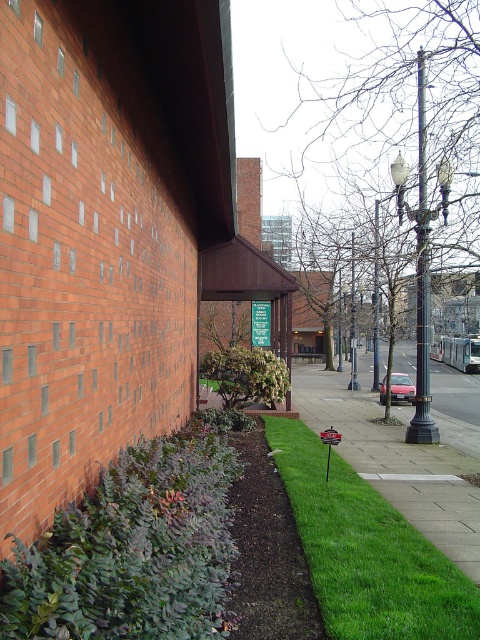
Between green leafy bush at lower left and black metal streetlamp at right, which one appears on the right side from the viewer's perspective?

From the viewer's perspective, black metal streetlamp at right appears more on the right side.

Is green leafy bush at lower left to the right of black metal streetlamp at right from the viewer's perspective?

No, green leafy bush at lower left is not to the right of black metal streetlamp at right.

Does point (8, 586) come behind point (408, 429)?

No, (8, 586) is closer to viewer.

Where is `green leafy bush at lower left`? The width and height of the screenshot is (480, 640). green leafy bush at lower left is located at coordinates (133, 548).

In the scene shown: Measure the distance between green leafy bush at lower left and camera.

They are 2.04 meters apart.

Can you confirm if green leafy bush at lower left is bigger than green leafy bush at center?

No.

Is point (121, 480) closer to camera compared to point (283, 368)?

Yes, point (121, 480) is closer to viewer.

The width and height of the screenshot is (480, 640). I want to click on green leafy bush at lower left, so pyautogui.click(x=133, y=548).

Is black metal streetlamp at right in front of green leafy bush at center?

Yes, black metal streetlamp at right is in front of green leafy bush at center.

Is black metal streetlamp at right thinner than green leafy bush at center?

Yes, black metal streetlamp at right is thinner than green leafy bush at center.

Find the location of a particular element. This screenshot has height=640, width=480. black metal streetlamp at right is located at coordinates (421, 285).